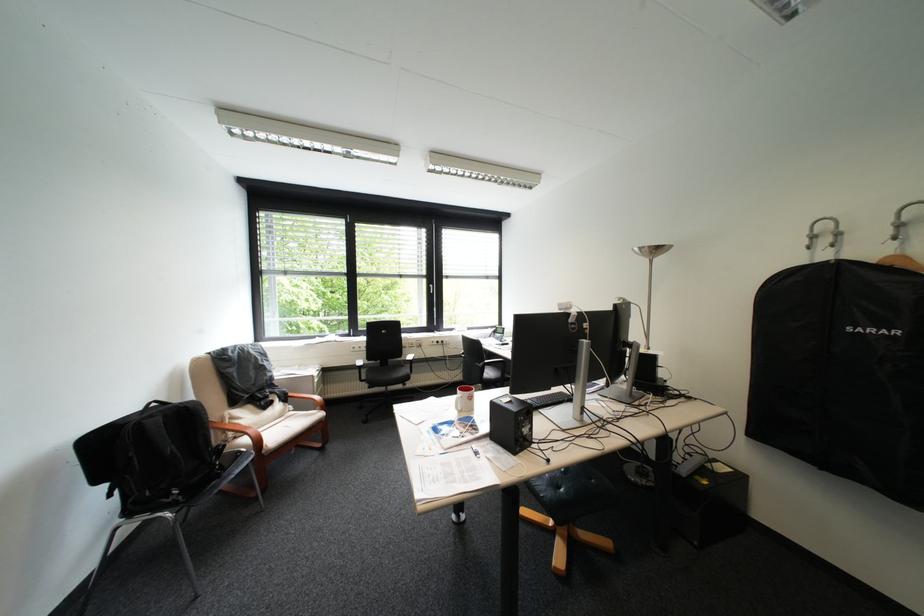
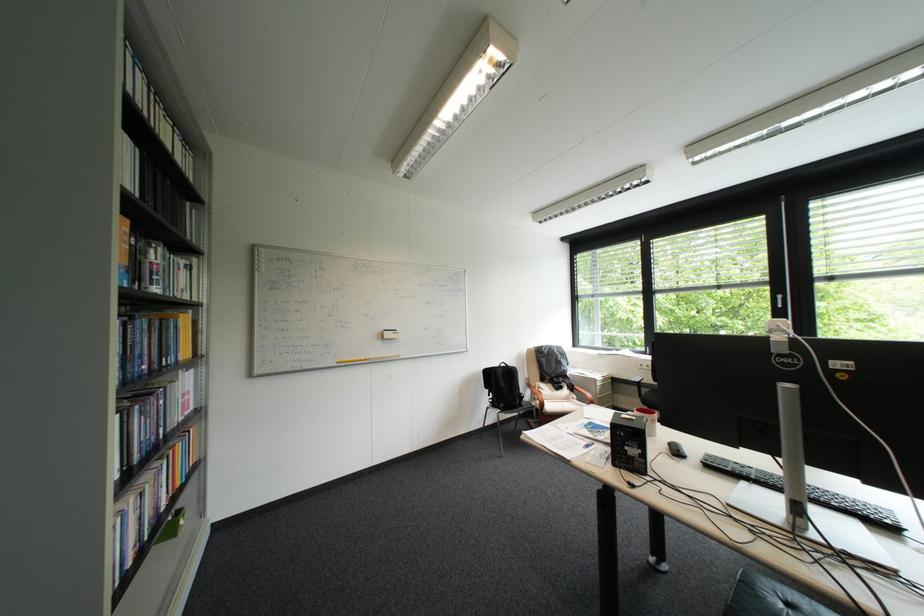
The point at [108,482] is marked in the first image. Where is the corresponding point in the second image?

(497, 387)